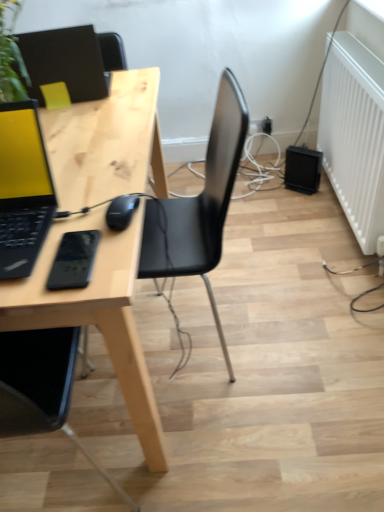
Locate an element on the screen. The height and width of the screenshot is (512, 384). vacant space to the left of black matte mouse at center is located at coordinates (62, 222).